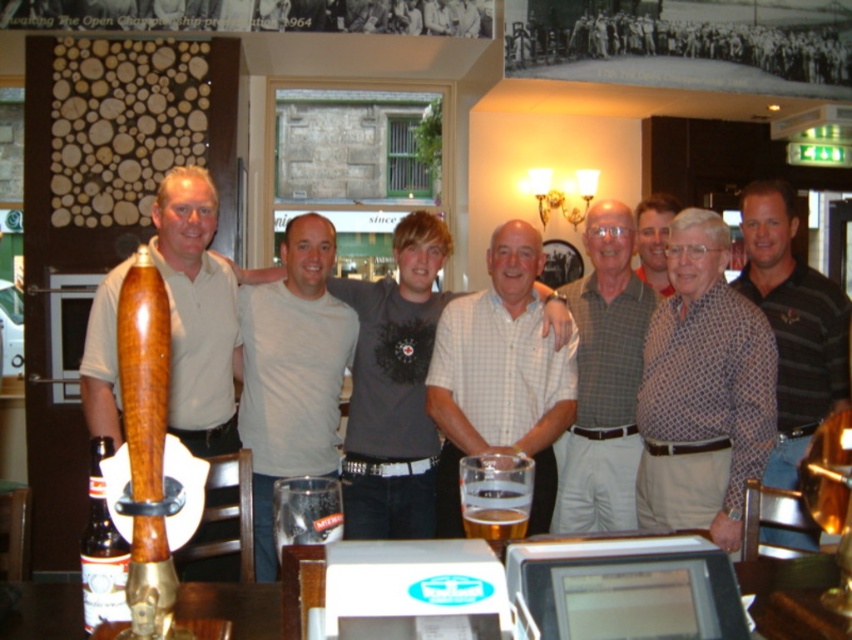
Question: Among these points, which one is farthest from the camera?

Choices:
 (A) (547, 483)
 (B) (504, 321)

Answer: (B)

Question: Can you confirm if matte gray t-shirt at center is thinner than checkered shirt at center?

Choices:
 (A) yes
 (B) no

Answer: (B)

Question: Is gray checkered shirt at center smaller than dark brown glass bottle at lower left?

Choices:
 (A) yes
 (B) no

Answer: (B)

Question: Which object is the closest to the matte red shirt at center?

Choices:
 (A) wooden tap handle at center
 (B) checkered shirt at center

Answer: (B)

Question: Based on their relative distances, which object is nearer to the matte red shirt at center?

Choices:
 (A) dark brown glass bottle at lower left
 (B) patterned shirt at center
 (C) gray checkered shirt at center

Answer: (C)

Question: Does matte gray t-shirt at center appear under checkered shirt at center?

Choices:
 (A) no
 (B) yes

Answer: (B)